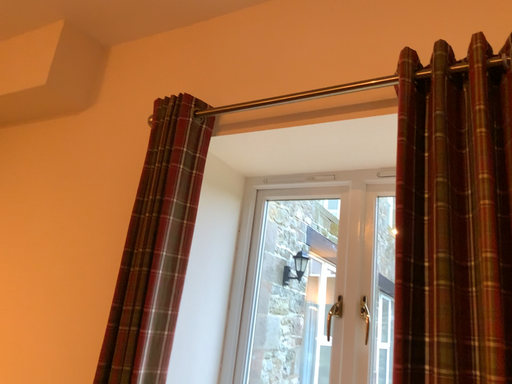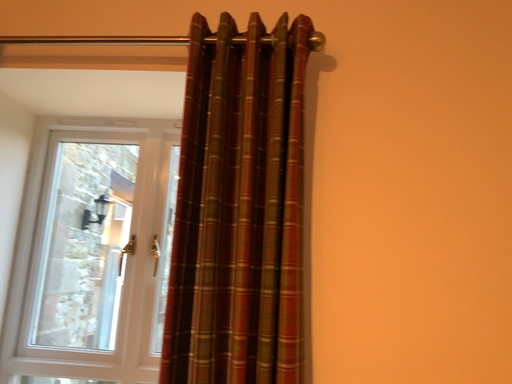
Question: How did the camera likely rotate when shooting the video?

Choices:
 (A) rotated right
 (B) rotated left

Answer: (A)